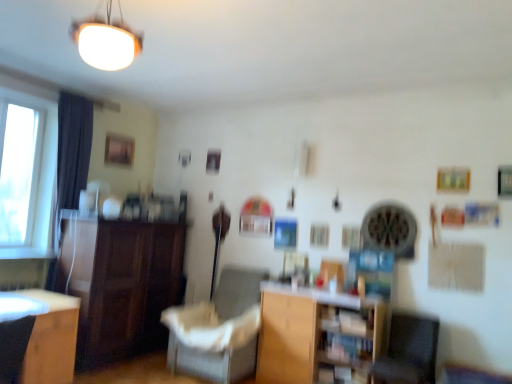
Question: Looking at the image, does wooden at center seem bigger or smaller compared to dark wood cabinet at left?

Choices:
 (A) small
 (B) big

Answer: (A)

Question: From a real-world perspective, is wooden at center physically located above or below dark wood cabinet at left?

Choices:
 (A) below
 (B) above

Answer: (A)

Question: Based on their relative distances, which object is nearer to the dark gray fabric armchair at lower left?

Choices:
 (A) gray fabric swivel chair at lower right
 (B) dark wood cabinet at left
 (C) white matte lampshade at upper center
 (D) wooden at center
 (E) dark fabric curtain at left

Answer: (B)

Question: Which object is the closest to the gray fabric swivel chair at lower right?

Choices:
 (A) wooden desk at lower left
 (B) white fabric chair at center
 (C) white matte lampshade at upper center
 (D) dark fabric curtain at left
 (E) dark wood cabinet at left

Answer: (B)